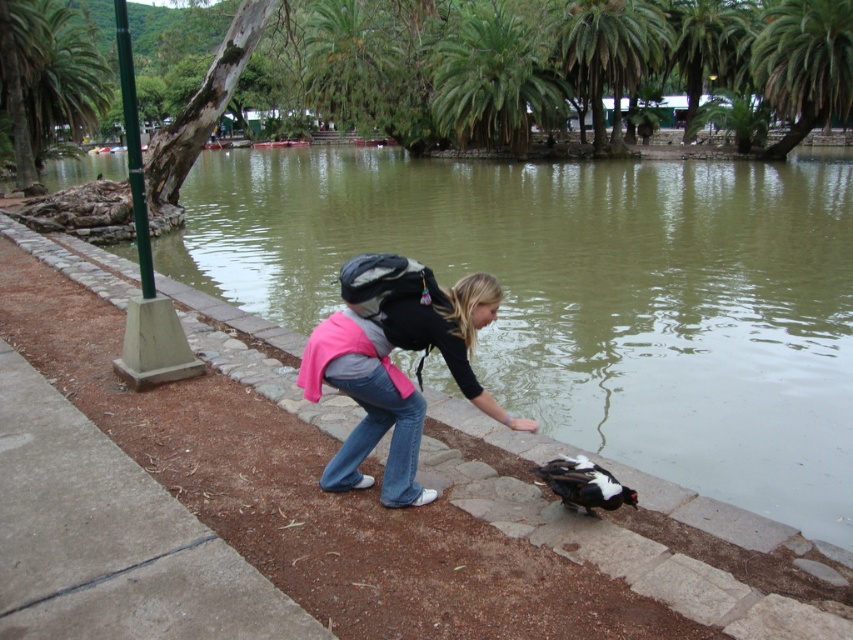
You are a photographer trying to capture the greenish water at center and the pink fabric backpack at center. Which object is closer to your camera lens?

The pink fabric backpack at center is closer to the camera lens because the greenish water at center is further away from the viewer.

You are a hiker who wants to cross the greenish water at center while carrying the pink fabric backpack at center. Based on the scene, can you safely step across the water without getting your feet wet?

The greenish water at center might be wider than pink fabric backpack at center, so it is uncertain if you can safely cross without getting wet. The width of the water could be greater than the backpack, making it difficult to step across.

You are planning to take a photo of the greenish water at center and the pink fabric backpack at center. Which object should you focus on first if you want to capture both in the frame without moving the camera?

The greenish water at center is larger in size than the pink fabric backpack at center, so you should focus on the greenish water at center first to ensure it fills the frame appropriately before adjusting for the smaller backpack.